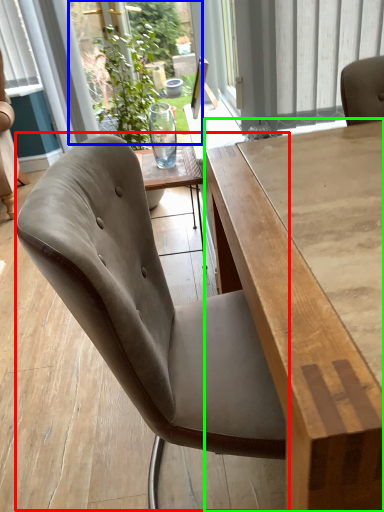
Question: Considering the real-world distances, which object is farthest from chair (highlighted by a red box)? window screen (highlighted by a blue box) or table (highlighted by a green box)?

Choices:
 (A) window screen
 (B) table

Answer: (A)